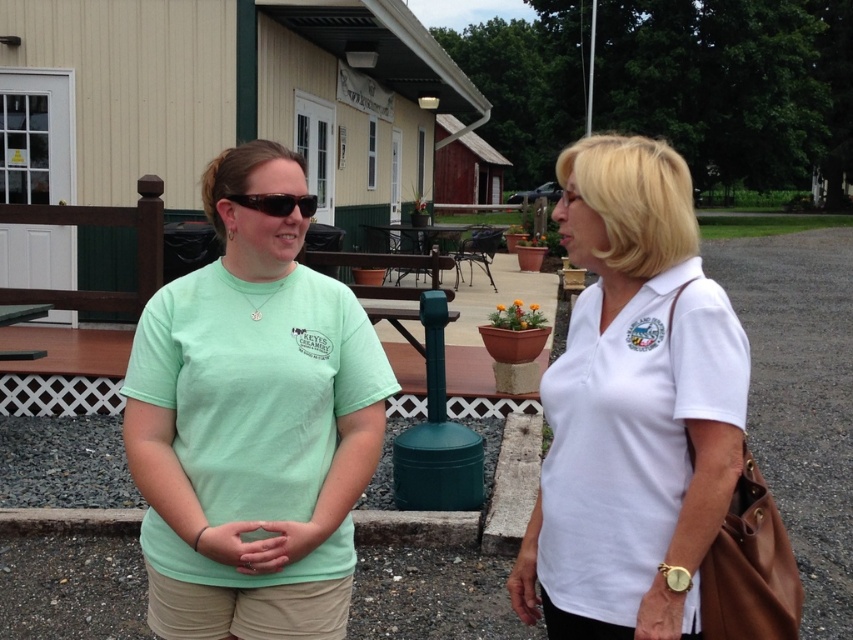
Question: Which object is positioned closest to the matte black sunglasses at center?

Choices:
 (A) mint green t-shirt at center
 (B) white matte shirt at center

Answer: (A)

Question: Does mint green t-shirt at center appear on the left side of matte black sunglasses at center?

Choices:
 (A) no
 (B) yes

Answer: (B)

Question: Among these objects, which one is nearest to the camera?

Choices:
 (A) matte black sunglasses at center
 (B) white matte shirt at center
 (C) mint green t-shirt at center

Answer: (B)

Question: In this image, where is mint green t-shirt at center located relative to white matte shirt at center?

Choices:
 (A) above
 (B) below

Answer: (A)

Question: Can you confirm if mint green t-shirt at center is positioned to the left of matte black sunglasses at center?

Choices:
 (A) no
 (B) yes

Answer: (B)

Question: Which object is farther from the camera taking this photo?

Choices:
 (A) matte black sunglasses at center
 (B) mint green t-shirt at center

Answer: (A)